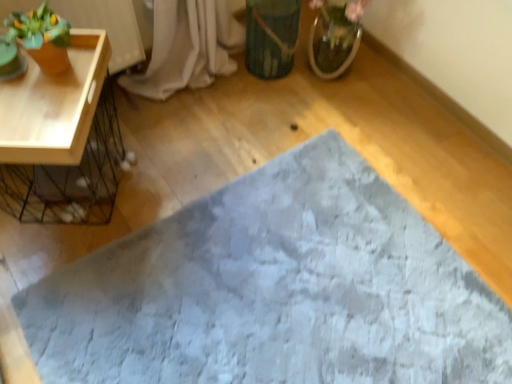
Find the location of `free point below gray textured bath mat at center (from a real-world perspective)`. free point below gray textured bath mat at center (from a real-world perspective) is located at coordinates (281, 293).